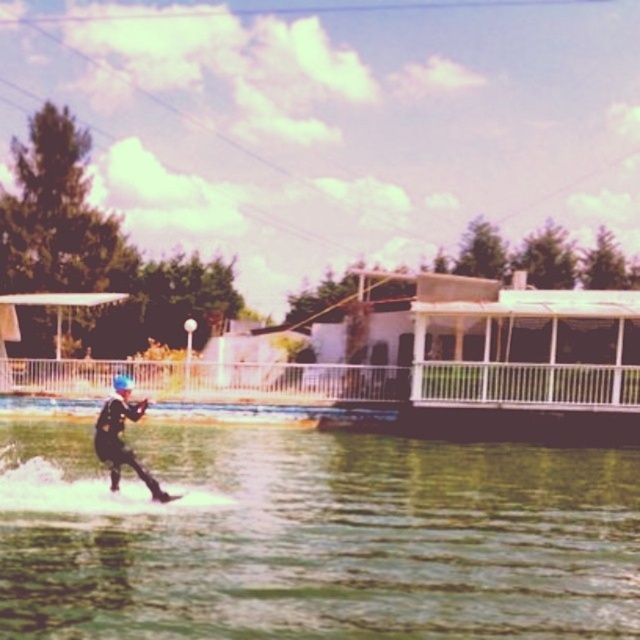
In the scene shown: You are a safety officer assessing the water skiing area. The safety regulations state that the distance between the water skier and the water must be at least 5 meters to prevent collisions. Based on the image, is the current distance between the greenish water at lower center and the black matte water skier at center compliant with the safety regulations?

The greenish water at lower center and the black matte water skier at center are 5.20 meters apart, which meets the minimum requirement of 5 meters. Therefore, the current distance is compliant with the safety regulations.

You are a photographer trying to capture the water skier and the water in the image. If you want to ensure both the black matte water skier at center and the greenish water at lower center are fully visible in your shot, which object should you focus on to frame the wider part?

The greenish water at lower center has a greater width than the black matte water skier at center, so focusing on the greenish water at lower center will allow you to frame the wider part of the scene to include both objects.

You are a photographer trying to capture the water skier and the water in the image. Given that the greenish water at lower center is larger in the frame than the black matte water skier at center, which object would you focus on first to ensure it fills more of the photo?

The greenish water at lower center should be focused on first because it has a larger size compared to the black matte water skier at center, ensuring it occupies more space in the photo.